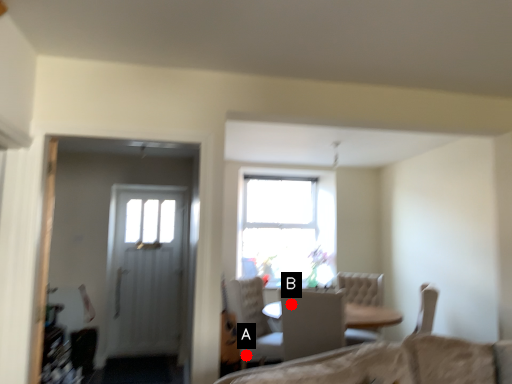
Question: Two points are circled on the image, labeled by A and B beside each circle. Which point is closer to the camera?

Choices:
 (A) A is closer
 (B) B is closer

Answer: (B)